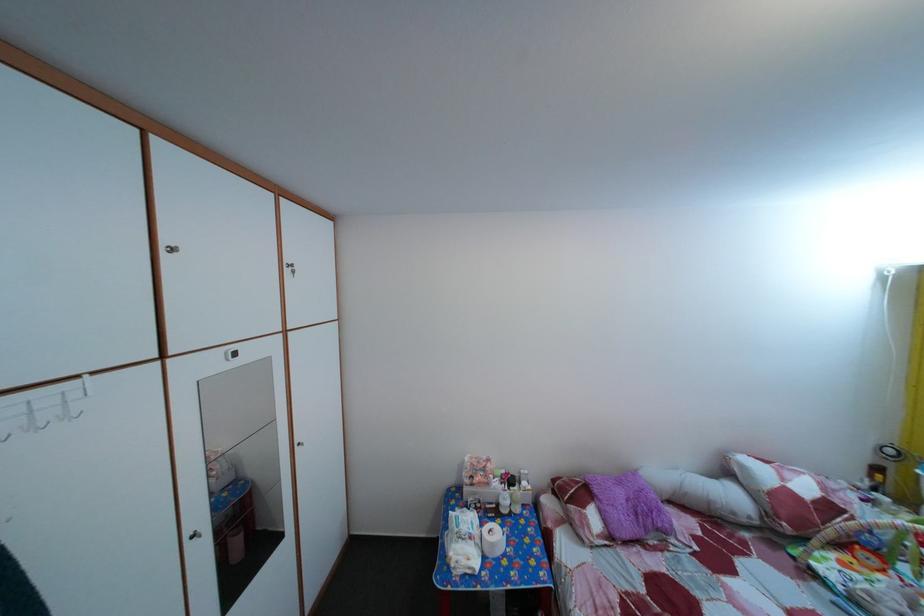
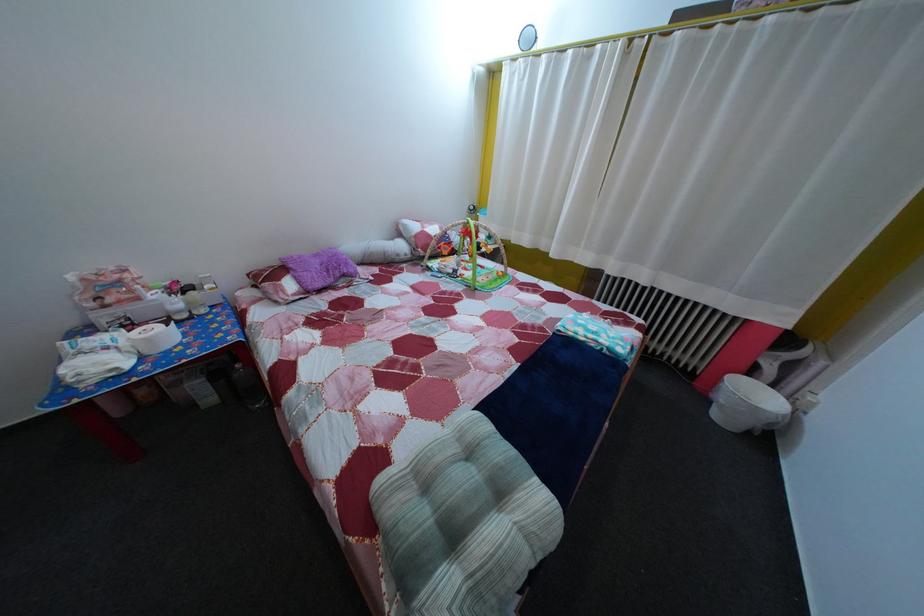
The point at (502,553) is marked in the first image. Where is the corresponding point in the second image?

(157, 347)